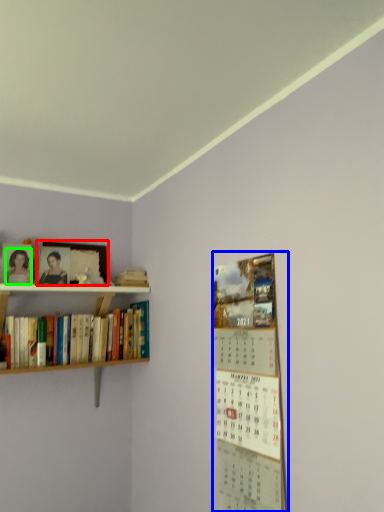
Question: Which object is positioned farthest from picture frame (highlighted by a red box)? Select from bulletin board (highlighted by a blue box) and person (highlighted by a green box).

Choices:
 (A) bulletin board
 (B) person

Answer: (A)